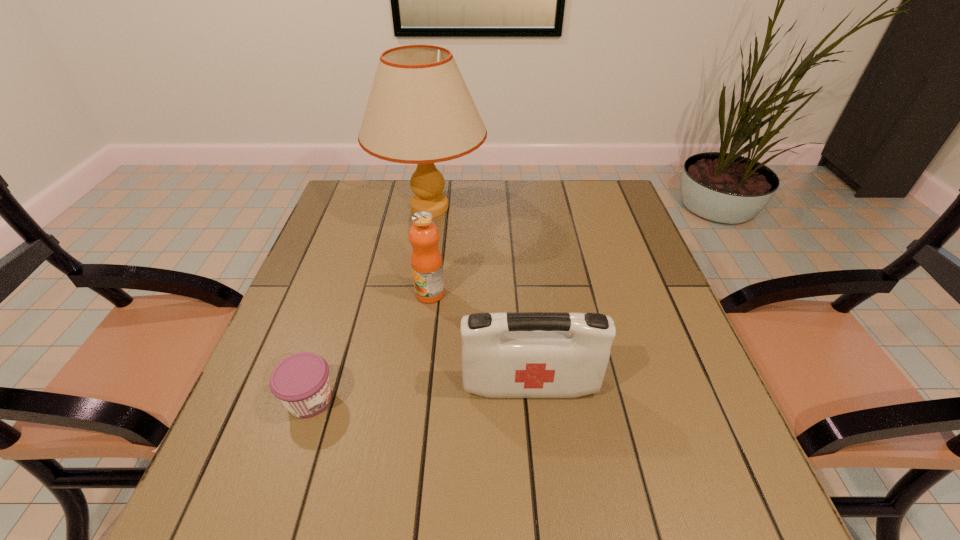
Find the location of a particular element. Image resolution: width=960 pixels, height=540 pixels. empty space that is in between the jam and the first-aid kit is located at coordinates (420, 393).

Image resolution: width=960 pixels, height=540 pixels. I want to click on vacant space that is in between the jam and the first-aid kit, so click(x=420, y=393).

You are a GUI agent. You are given a task and a screenshot of the screen. Output one action in this format:
    pyautogui.click(x=<x>, y=<y>)
    Task: Click on the empty location between the first-aid kit and the jam
    
    Given the screenshot: What is the action you would take?
    pyautogui.click(x=420, y=393)

Find the location of a particular element. This screenshot has height=540, width=960. vacant space that is in between the shortest object and the farthest object is located at coordinates (370, 303).

Select which object is the closest to the tallest object. Please provide its 2D coordinates. Your answer should be formatted as a tuple, i.e. [(x, y)], where the tuple contains the x and y coordinates of a point satisfying the conditions above.

[(426, 261)]

You are a GUI agent. You are given a task and a screenshot of the screen. Output one action in this format:
    pyautogui.click(x=<x>, y=<y>)
    Task: Click on the object that can be found as the third closest to the third nearest object
    
    Given the screenshot: What is the action you would take?
    pyautogui.click(x=301, y=382)

Image resolution: width=960 pixels, height=540 pixels. What are the coordinates of `vacant space that satisfies the following two spatial constraints: 1. on the front side of the first-aid kit; 2. on the front label of the shortest object` in the screenshot? It's located at 532,399.

The image size is (960, 540). I want to click on free space in the image that satisfies the following two spatial constraints: 1. on the front side of the first-aid kit; 2. on the front label of the shortest object, so click(532, 399).

Locate an element on the screen. The image size is (960, 540). blank space that satisfies the following two spatial constraints: 1. on the front side of the first-aid kit; 2. on the front label of the jam is located at coordinates (532, 399).

What are the coordinates of `vacant space that satisfies the following two spatial constraints: 1. on the front side of the first-aid kit; 2. on the front label of the jam` in the screenshot? It's located at (532, 399).